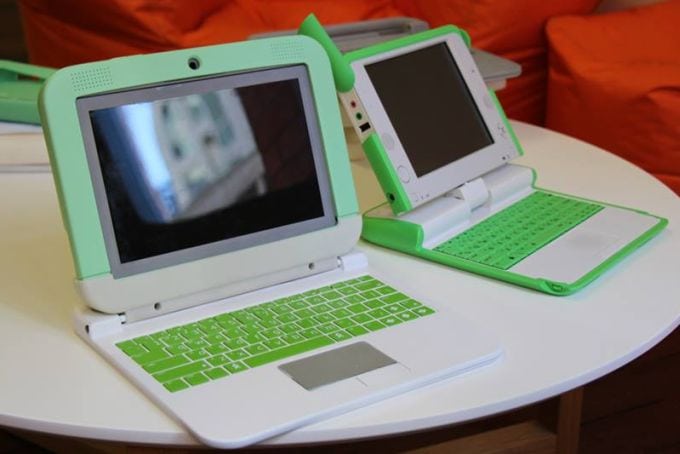
Image resolution: width=680 pixels, height=454 pixels. In order to click on keyboard in this screenshot , I will do `click(279, 331)`, `click(520, 225)`.